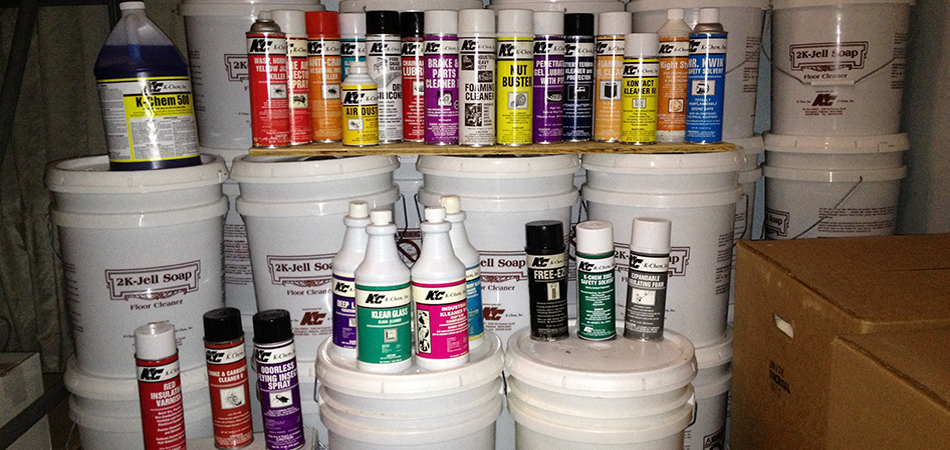
You are a GUI agent. You are given a task and a screenshot of the screen. Output one action in this format:
    pyautogui.click(x=<x>, y=<y>)
    Task: Click on the box
    This screenshot has height=450, width=950.
    Given the screenshot: What is the action you would take?
    click(x=747, y=273)